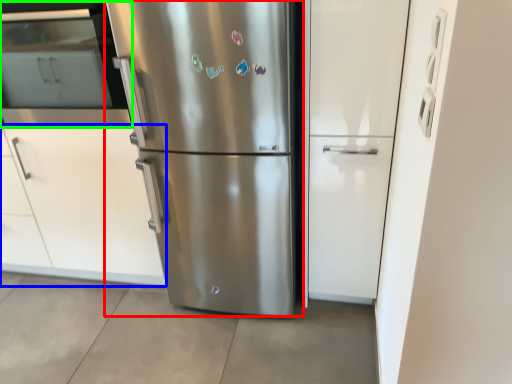
Question: Which object is the farthest from refrigerator (highlighted by a red box)? Choose among these: cabinetry (highlighted by a blue box) or oven (highlighted by a green box).

Choices:
 (A) cabinetry
 (B) oven

Answer: (B)